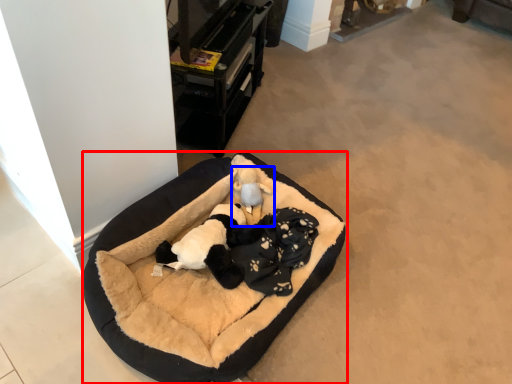
Question: Among these objects, which one is farthest to the camera, dog bed (highlighted by a red box) or toy (highlighted by a blue box)?

Choices:
 (A) dog bed
 (B) toy

Answer: (B)